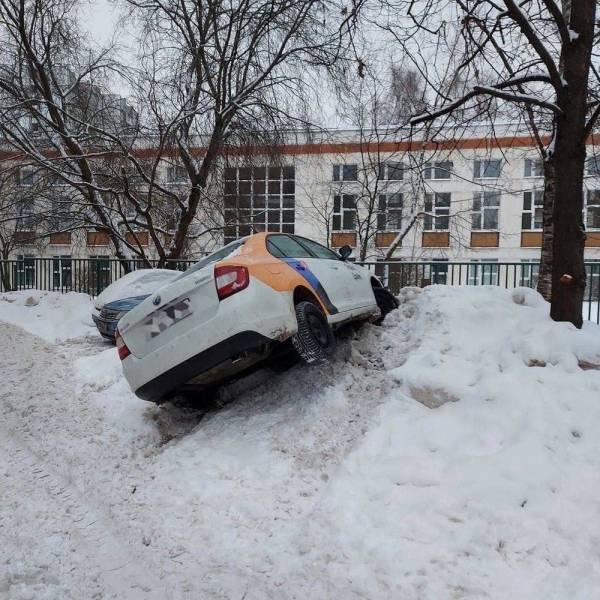
The width and height of the screenshot is (600, 600). Identify the location of door. (355, 271).